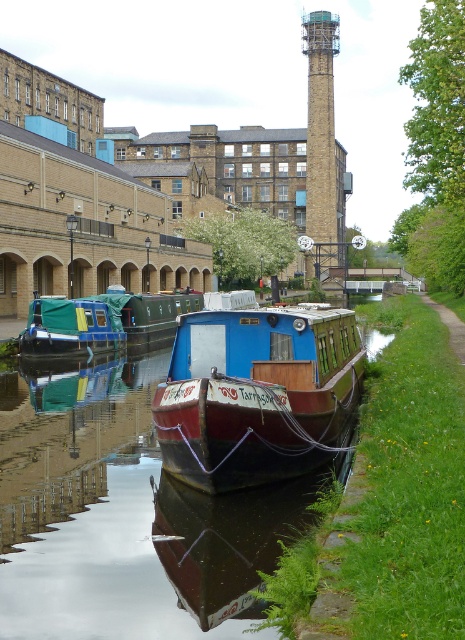
Question: Among these objects, which one is farthest from the camera?

Choices:
 (A) green canvas boat at center
 (B) smooth dark water at center
 (C) teal fabric-covered boat at center
 (D) maroon wooden boat at center

Answer: (C)

Question: Considering the relative positions of maroon wooden boat at center and teal fabric-covered boat at center in the image provided, where is maroon wooden boat at center located with respect to teal fabric-covered boat at center?

Choices:
 (A) above
 (B) below

Answer: (B)

Question: Which point is closer to the camera?

Choices:
 (A) smooth dark water at center
 (B) maroon wooden boat at center
 (C) green canvas boat at center
 (D) teal fabric-covered boat at center

Answer: (A)

Question: Based on their relative distances, which object is farther from the maroon wooden boat at center?

Choices:
 (A) smooth dark water at center
 (B) green canvas boat at center
 (C) teal fabric-covered boat at center

Answer: (B)

Question: Does smooth dark water at center appear on the left side of maroon wooden boat at center?

Choices:
 (A) yes
 (B) no

Answer: (A)

Question: Can you confirm if maroon wooden boat at center is positioned to the left of green canvas boat at center?

Choices:
 (A) yes
 (B) no

Answer: (B)